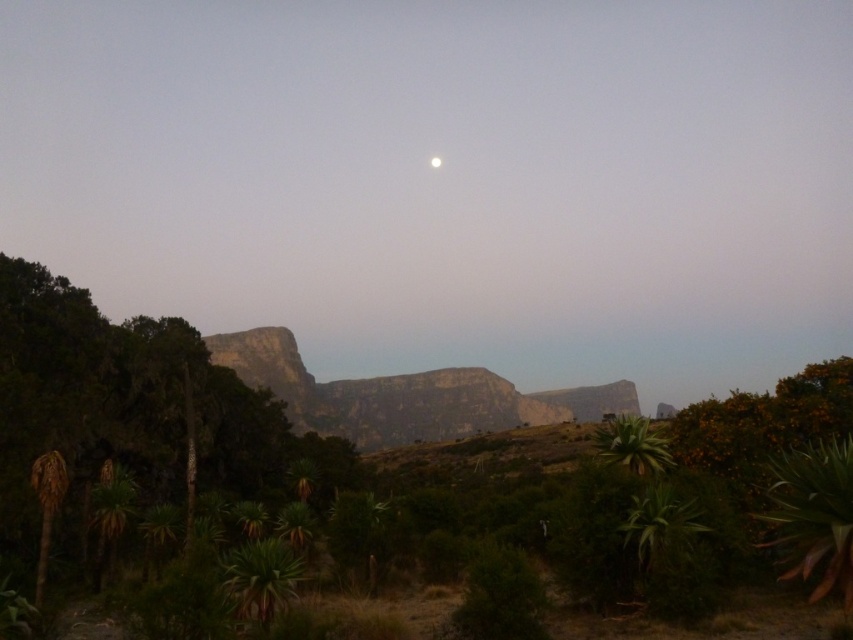
Question: Is green leafy plant at lower right bigger than green succulent plant at lower right?

Choices:
 (A) yes
 (B) no

Answer: (B)

Question: Which object is the closest to the rocky cliff at center?

Choices:
 (A) green leafy plant at lower right
 (B) green leafy palm at left
 (C) green succulent plant at lower right

Answer: (C)

Question: Where is green succulent plant at lower right located in relation to green leafy palm at left in the image?

Choices:
 (A) right
 (B) left

Answer: (A)

Question: In this image, where is green leafy plant at lower right located relative to green leafy palm at left?

Choices:
 (A) below
 (B) above

Answer: (B)

Question: Which of the following is the farthest from the observer?

Choices:
 (A) rocky cliff at center
 (B) green leafy plant at lower right

Answer: (A)

Question: Which object appears closest to the camera in this image?

Choices:
 (A) green succulent plant at lower right
 (B) green leafy palm at left
 (C) green leafy plant at lower right

Answer: (C)